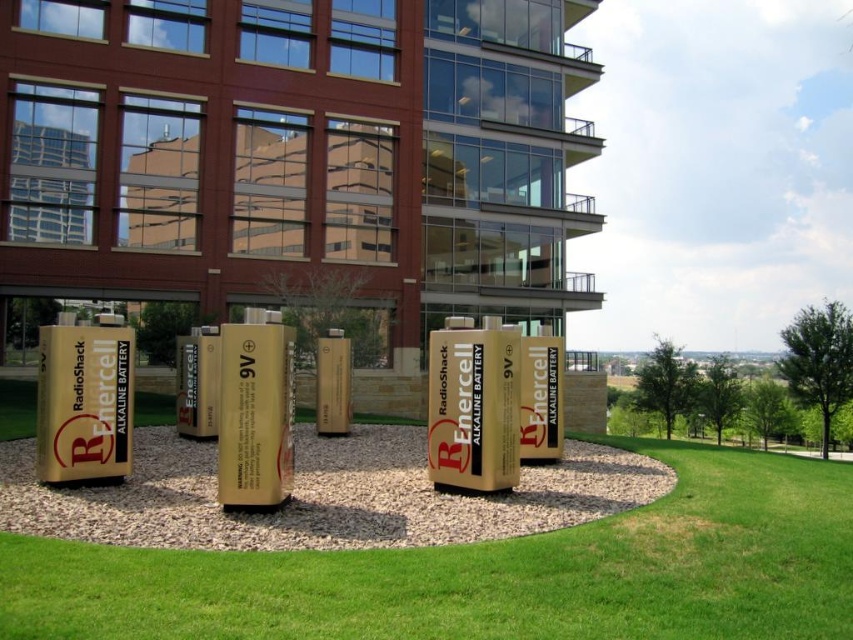
You are a gardener who needs to mow the lawn. You see the green grass at center and the gold gravel at center. Which area requires mowing?

The green grass at center requires mowing because it is much taller than the gold gravel at center.

You are standing in the landscaped area of the urban scene and see two points marked in the image. Which point is closer to you, point (775, 470) or point (235, 522)?

Point (775, 470) is further to the viewer than point (235, 522), so the closer point to you is point (235, 522).